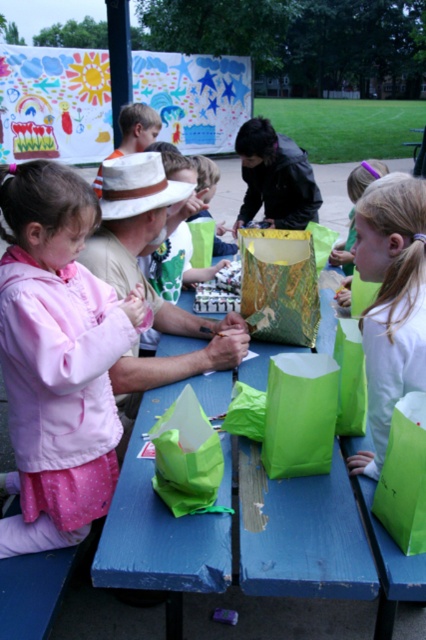
You are a photographer standing in front of the blue wood table at center and the pink fabric dress at lower left. You want to take a photo that includes both objects in the frame. Which object should be placed closer to the camera to ensure both are visible without moving the camera?

The pink fabric dress at lower left should be placed closer to the camera because the blue wood table at center is behind it, so moving the dress forward would allow both to be in the frame without obstruction.

You are organizing a craft activity for kids. You have a blue wood table at center and a matte green paper bag at center. Which object should you place first to ensure there is enough space for both?

The blue wood table at center is larger in size than the matte green paper bag at center, so you should place the blue wood table at center first to ensure there is enough space for both.

You are a photographer trying to capture a shot of the craft activity. You need to position yourself so that the pink fabric dress at lower left and the white paper bag at center are both in frame. Based on their positions, which object should you place on the left side of your photo?

The pink fabric dress at lower left should be placed on the left side of the photo since it is to the left of the white paper bag at center.